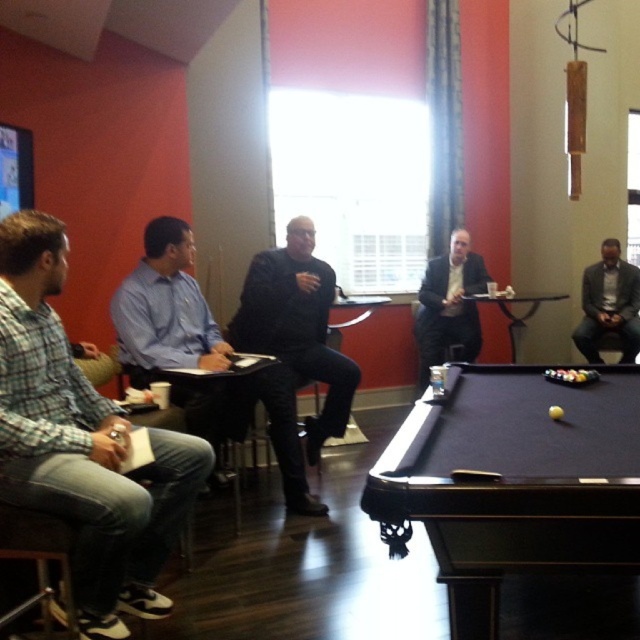
You are standing in the room and want to greet both the person in the blue shirt at center and the person in the dark gray suit at center. Which person should you approach first if you want to greet the one closer to the pool table?

The blue shirt at center is to the left of dark gray suit at center, so the blue shirt at center is closer to the pool table positioned towards the right side of the frame. Approach the blue shirt at center first.

You are a photographer taking a group photo of the people in the scene. You need to arrange them so that the plaid cotton shirt at left and the blue shirt at center are visible. Based on their current positions, which shirt should be placed to the left in the final photo?

The plaid cotton shirt at left should be placed to the left in the final photo since it is already positioned on the left side of the blue shirt at center.

You are a photographer standing at the entrance of the room. You want to take a photo of the blue shirt at center and dark gray suit at center so that both are in focus. Given that your camera has a depth of field that can cover 3 meters, will both subjects be in focus?

The blue shirt at center and dark gray suit at center are 3.15 meters apart. Since the camera can only cover 3 meters, the distance between them exceeds the depth of field capacity, so both subjects cannot be in focus simultaneously.